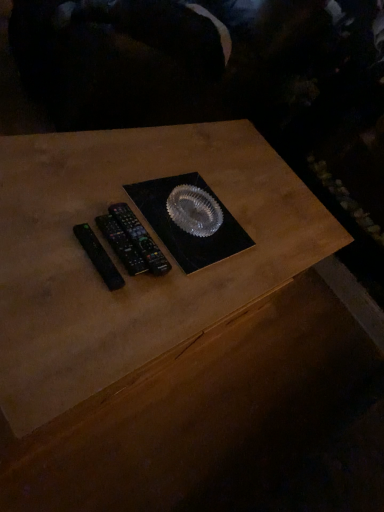
Question: Which direction should I rotate to face black plastic remote controls at center, which is the 1th control from back to front, — up or down?

Choices:
 (A) down
 (B) up

Answer: (B)

Question: Does black plastic remote at left, placed as the third control when sorted from back to front, appear on the right side of black plastic remote controls at center, which is the 1th control from back to front?

Choices:
 (A) no
 (B) yes

Answer: (A)

Question: Considering the relative sizes of black plastic remote at left, placed as the third control when sorted from back to front, and black plastic remote controls at center, which is the 1th control from back to front, in the image provided, is black plastic remote at left, placed as the third control when sorted from back to front, shorter than black plastic remote controls at center, which is the 1th control from back to front,?

Choices:
 (A) yes
 (B) no

Answer: (A)

Question: From the image's perspective, is black plastic remote at left, the 1th control viewed from the front, located beneath black plastic remote controls at center, which is the 1th control from back to front?

Choices:
 (A) no
 (B) yes

Answer: (B)

Question: Considering the relative sizes of black plastic remote at left, the 1th control viewed from the front, and black plastic remote controls at center, acting as the 3th control starting from the front, in the image provided, is black plastic remote at left, the 1th control viewed from the front, wider than black plastic remote controls at center, acting as the 3th control starting from the front,?

Choices:
 (A) yes
 (B) no

Answer: (B)

Question: Is black plastic remote at left, placed as the third control when sorted from back to front, oriented away from black plastic remote controls at center, acting as the 3th control starting from the front?

Choices:
 (A) yes
 (B) no

Answer: (A)

Question: Is black plastic remote at left, placed as the third control when sorted from back to front, thinner than black plastic remote controls at center, which is the 1th control from back to front?

Choices:
 (A) no
 (B) yes

Answer: (B)

Question: Considering the relative positions of black plastic remote at left, the second control from the back, and black plastic remote controls at center, which is the 1th control from back to front, in the image provided, is black plastic remote at left, the second control from the back, to the left of black plastic remote controls at center, which is the 1th control from back to front, from the viewer's perspective?

Choices:
 (A) yes
 (B) no

Answer: (A)

Question: Could you tell me if black plastic remote at left, positioned as the second control in front-to-back order, is facing black plastic remote controls at center, which is the 1th control from back to front?

Choices:
 (A) yes
 (B) no

Answer: (A)

Question: Does black plastic remote at left, positioned as the second control in front-to-back order, have a larger size compared to black plastic remote controls at center, acting as the 3th control starting from the front?

Choices:
 (A) no
 (B) yes

Answer: (A)

Question: Is black plastic remote at left, positioned as the second control in front-to-back order, looking in the opposite direction of black plastic remote controls at center, which is the 1th control from back to front?

Choices:
 (A) yes
 (B) no

Answer: (A)

Question: Does black plastic remote at left, positioned as the second control in front-to-back order, have a greater width compared to black plastic remote controls at center, acting as the 3th control starting from the front?

Choices:
 (A) yes
 (B) no

Answer: (B)

Question: From the image's perspective, is black plastic remote at left, positioned as the second control in front-to-back order, beneath black plastic remote controls at center, acting as the 3th control starting from the front?

Choices:
 (A) yes
 (B) no

Answer: (A)

Question: Considering the relative sizes of black plastic remote controls at center, which is the 1th control from back to front, and black plastic remote at left, the second control from the back, in the image provided, is black plastic remote controls at center, which is the 1th control from back to front, bigger than black plastic remote at left, the second control from the back,?

Choices:
 (A) yes
 (B) no

Answer: (A)